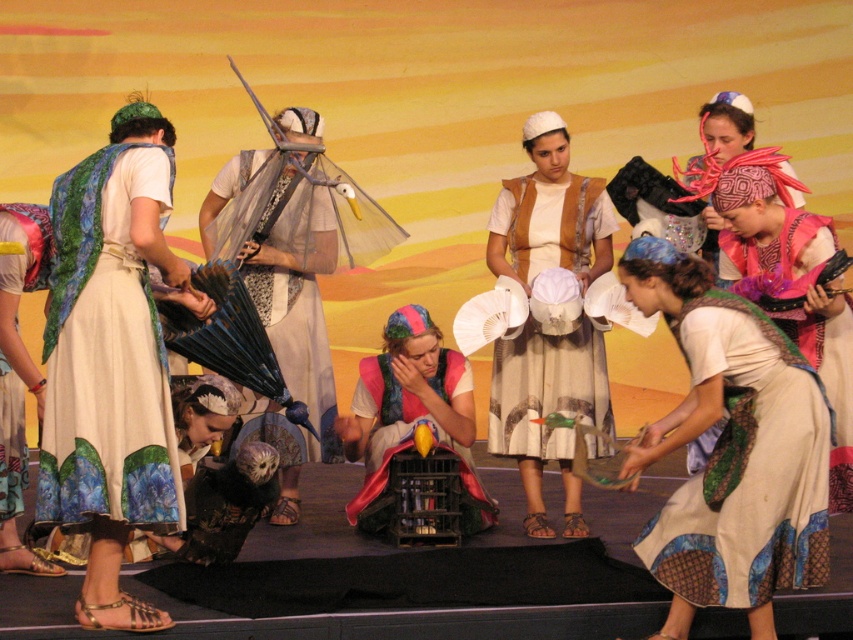
You are sitting in the audience watching the performance. There are two points marked on the stage floor at coordinates point (843, 348) and point (383, 394). Which point is closer to your view from the audience seats?

Point (843, 348) is closer to the camera than point (383, 394), so the point at (843, 348) is closer to your view from the audience seats.

You are a stagehand who needs to place a 1.5 meters long pole between the matte green scarf at center and the matte fabric bird at center. Will the pole fit between them without overlapping either object?

The distance between the matte green scarf at center and the matte fabric bird at center is 1.39 meters. Since the pole is 1.5 meters long, it is longer than the available space. Therefore, the pole will not fit between them without overlapping the objects.

You are a stage director observing the performance. You need to adjust the spotlight to focus on the matte green scarf at center. According to the coordinates provided, where should you position the spotlight relative to the stage?

The matte green scarf at center is located at coordinates point (x=730, y=449), so you should position the spotlight at that point to focus on it.